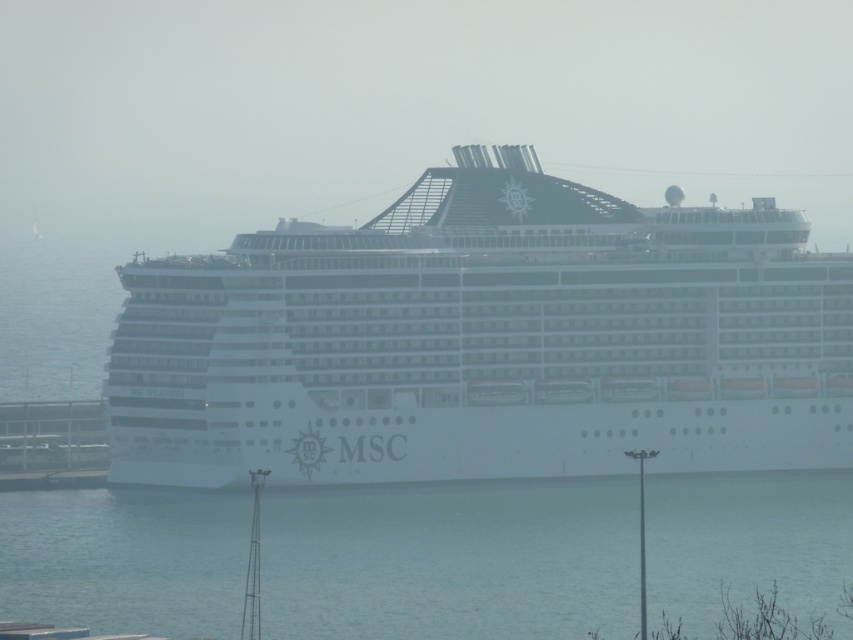
Does white matte cruise ship at center have a larger size compared to clear blue water at lower center?

Indeed, white matte cruise ship at center has a larger size compared to clear blue water at lower center.

Is point (556, 285) closer to viewer compared to point (561, 554)?

Yes, point (556, 285) is closer to viewer.

Where is `white matte cruise ship at center`? The image size is (853, 640). white matte cruise ship at center is located at coordinates (486, 340).